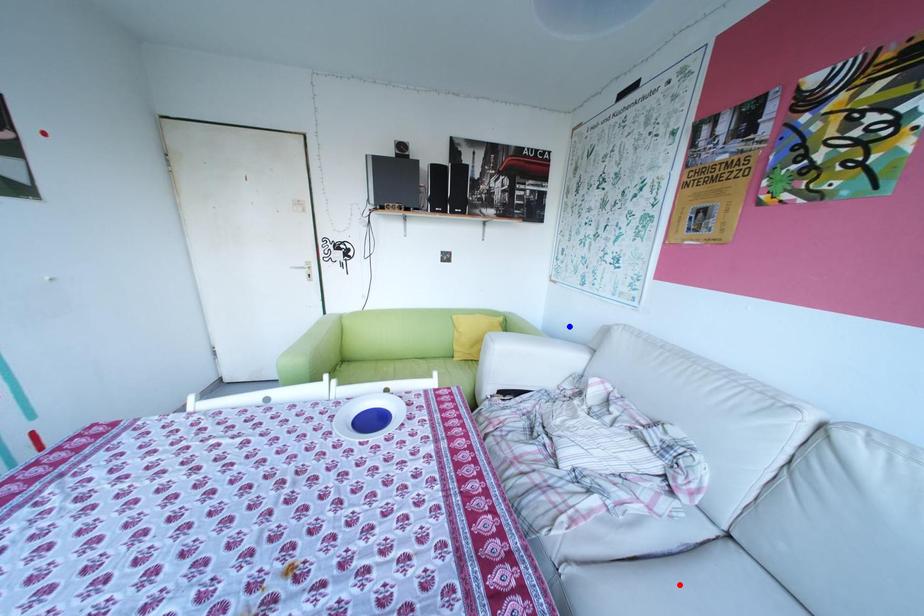
Question: Which of the two points in the image is closer to the camera?

Choices:
 (A) Blue point is closer.
 (B) Red point is closer.

Answer: (B)